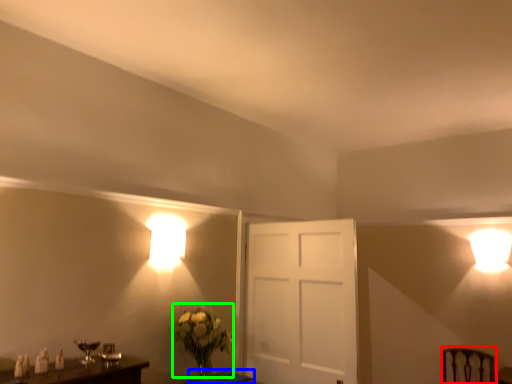
Question: Which object is the closest to the swivel chair (highlighted by a red box)? Choose among these: table (highlighted by a blue box) or floral arrangement (highlighted by a green box).

Choices:
 (A) table
 (B) floral arrangement

Answer: (A)